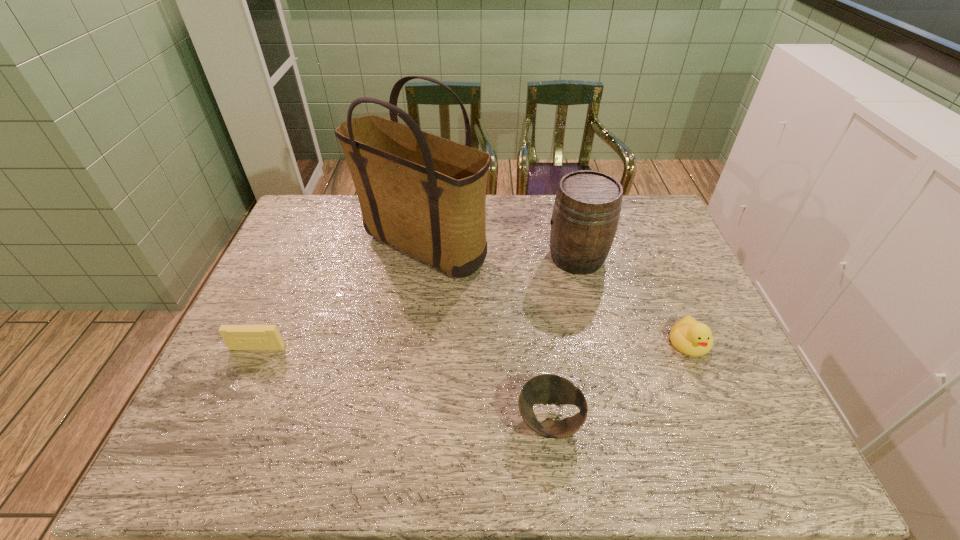
In order to click on the tallest object in this screenshot , I will do `click(426, 195)`.

Locate an element on the screen. The height and width of the screenshot is (540, 960). the second object from left to right is located at coordinates (426, 195).

Where is `cider`? The image size is (960, 540). cider is located at coordinates (586, 211).

Locate an element on the screen. the rightmost object is located at coordinates (688, 336).

Where is `the leftmost object`? This screenshot has height=540, width=960. the leftmost object is located at coordinates (237, 337).

Identify the location of the nearest object. This screenshot has width=960, height=540. (544, 389).

Locate an element on the screen. The height and width of the screenshot is (540, 960). vacant space located 0.110m on the left of the tallest object is located at coordinates (321, 247).

This screenshot has height=540, width=960. I want to click on vacant space situated 0.250m on the side of the cider near the bung hole, so [x=467, y=257].

The image size is (960, 540). I want to click on vacant space situated 0.060m on the side of the cider near the bung hole, so click(x=527, y=257).

This screenshot has height=540, width=960. Identify the location of vacant space situated on the side of the cider near the bung hole. (432, 257).